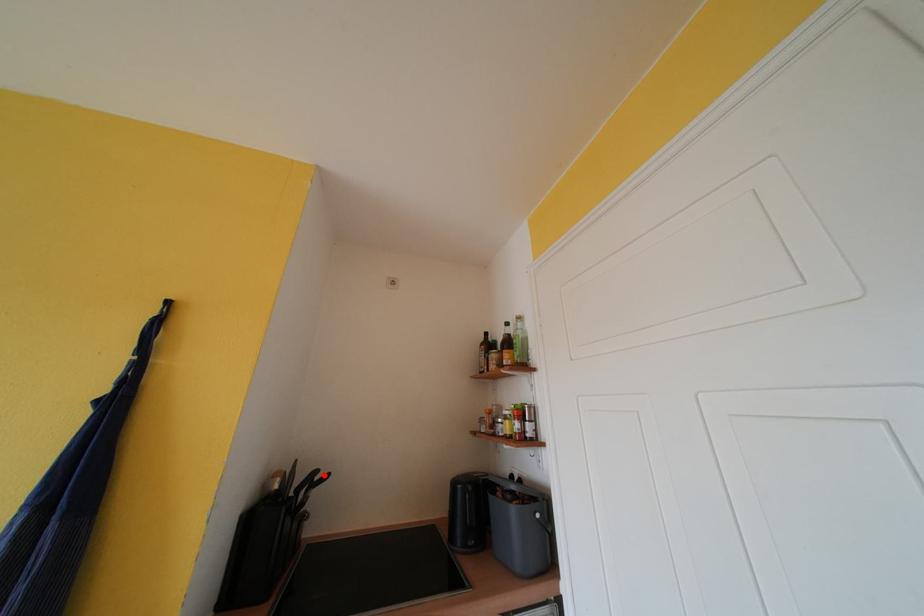
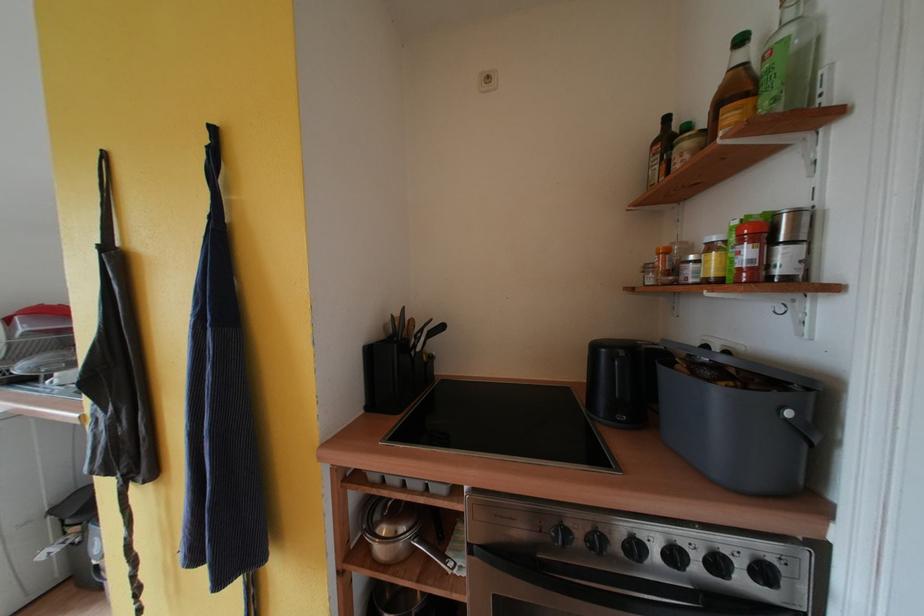
Locate, in the second image, the point that corresponds to the highlighted location in the first image.

(436, 323)